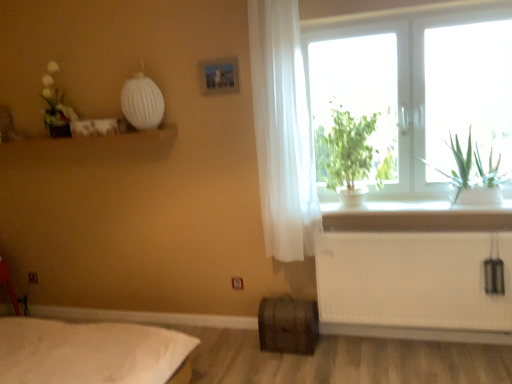
Question: From the image's perspective, relative to white glass window at upper right, is rustic wooden barrel at lower center above or below?

Choices:
 (A) above
 (B) below

Answer: (B)

Question: Is rustic wooden barrel at lower center spatially inside white glass window at upper right, or outside of it?

Choices:
 (A) inside
 (B) outside

Answer: (B)

Question: Which of these objects is positioned farthest from the white sheer curtain at right?

Choices:
 (A) white textured radiator at lower right
 (B) metallic silver picture frame at upper center
 (C) green leafy plant at window
 (D) rustic wooden barrel at lower center
 (E) white glass window at upper right

Answer: (C)

Question: Which object is the closest to the metallic silver picture frame at upper center?

Choices:
 (A) white sheer curtain at right
 (B) white glass window at upper right
 (C) white textured radiator at lower right
 (D) green leafy plant at window
 (E) rustic wooden barrel at lower center

Answer: (A)